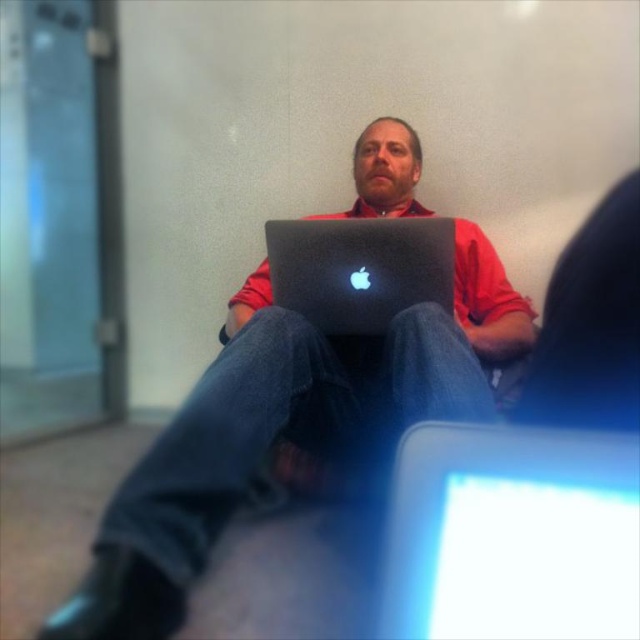
Question: Which object is positioned closest to the matte black laptop at center?

Choices:
 (A) sleek silver laptop at center
 (B) satin black laptop at center

Answer: (B)

Question: Does matte black laptop at center have a larger size compared to sleek silver laptop at center?

Choices:
 (A) yes
 (B) no

Answer: (A)

Question: Does matte black laptop at center have a lesser width compared to sleek silver laptop at center?

Choices:
 (A) no
 (B) yes

Answer: (A)

Question: Which point is closer to the camera?

Choices:
 (A) matte black laptop at center
 (B) satin black laptop at center

Answer: (A)

Question: Where is matte black laptop at center located in relation to sleek silver laptop at center in the image?

Choices:
 (A) below
 (B) above

Answer: (B)

Question: Based on their relative distances, which object is nearer to the matte black laptop at center?

Choices:
 (A) sleek silver laptop at center
 (B) satin black laptop at center

Answer: (B)